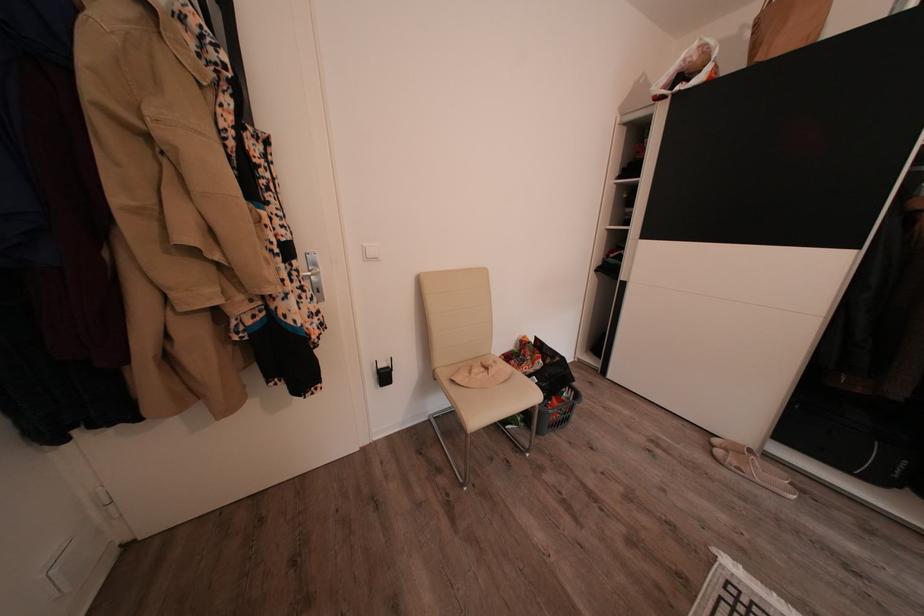
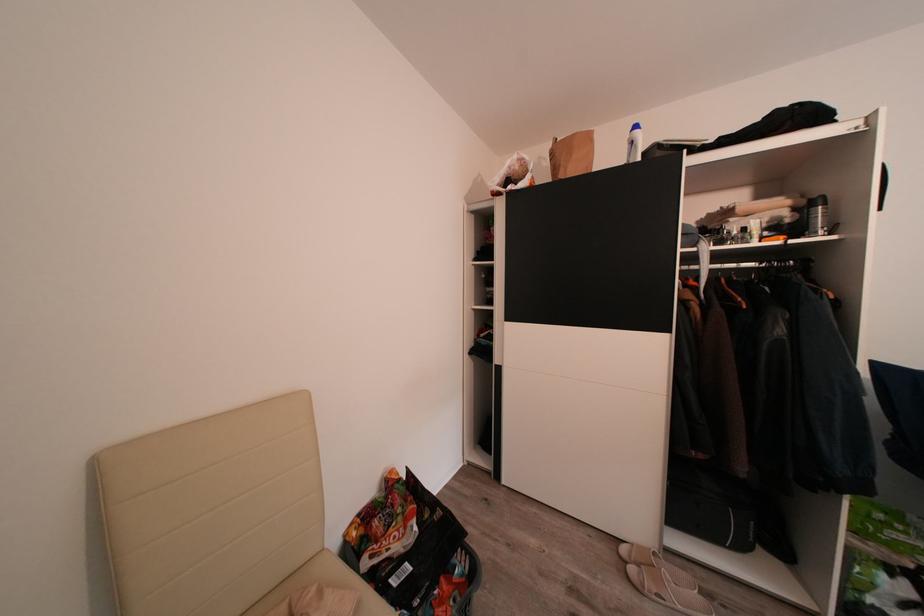
Question: The images are taken continuously from a first-person perspective. In which direction is your viewpoint rotating?

Choices:
 (A) Left
 (B) Right
 (C) Up
 (D) Down

Answer: (B)